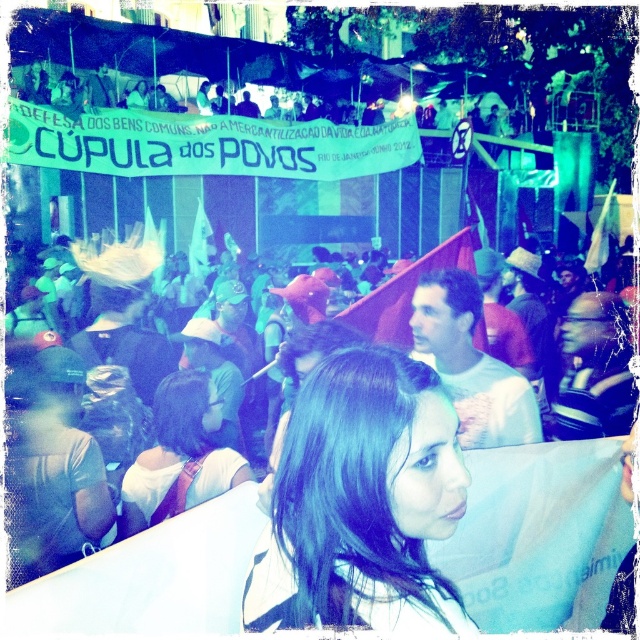
You are a photographer trying to capture a clear shot of the matte black glasses at center and the red fabric flag at center. Which object should you zoom in on to ensure both are in focus without moving your camera position?

The matte black glasses at center is wider than the red fabric flag at center, so you should zoom in on the red fabric flag at center to ensure both objects are in focus without moving the camera.

You are a photographer trying to capture the protest scene. You notice two points in the image at coordinates point [332,381] and point [237,483]. Which point is closer to your camera lens?

Point [332,381] is closer to the camera than point [237,483].

You are a photographer trying to capture a clear shot of both the dark brown hair at center and the matte brown hair at center. Based on their positions, which one should you adjust your focus to first to ensure both are in frame?

Since the dark brown hair at center is closer to the viewer than the matte brown hair at center, you should focus on the dark brown hair at center first. This way, adjusting the focus outward slightly will allow the matte brown hair at center to come into view as well.